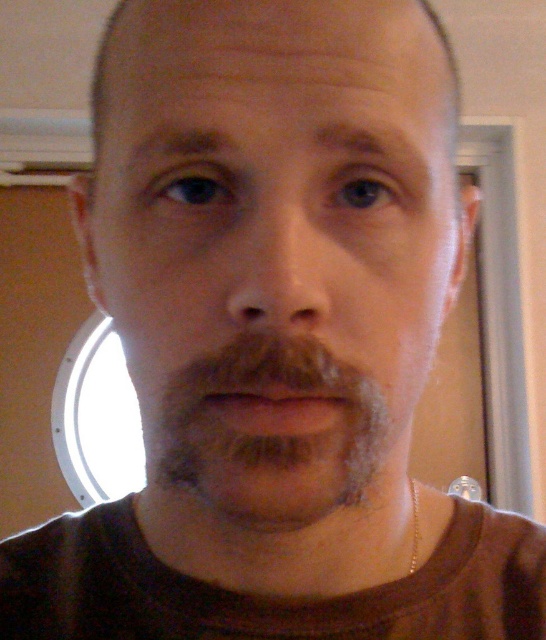
Looking at the person in the image, where is the smooth skin face at center in relation to the gray fuzzy beard at center?

The smooth skin face at center is located to the left of the gray fuzzy beard at center.

You are a photographer adjusting the focus of your camera. The subject has a smooth skin face at center and a gray fuzzy beard at center. Since the camera can only focus on one object at a time, which object should you focus on to ensure the other is still in acceptable focus range? The acceptable focus range is 1.5 inches.

The smooth skin face at center is 2.02 inches away from the gray fuzzy beard at center. Since the distance between them exceeds the 1.5 inches acceptable focus range, the photographer must choose one to focus on. If focusing on the smooth skin face at center, the beard would be out of focus. Similarly, focusing on the beard would leave the face out of focus. Therefore, the photographer cannot have both in focus simultaneously within the given range.

Looking at this image, looking at the person in the image, where is the smooth skin face at center in relation to the brown matte lips at center?

The smooth skin face at center is located above the brown matte lips at center.